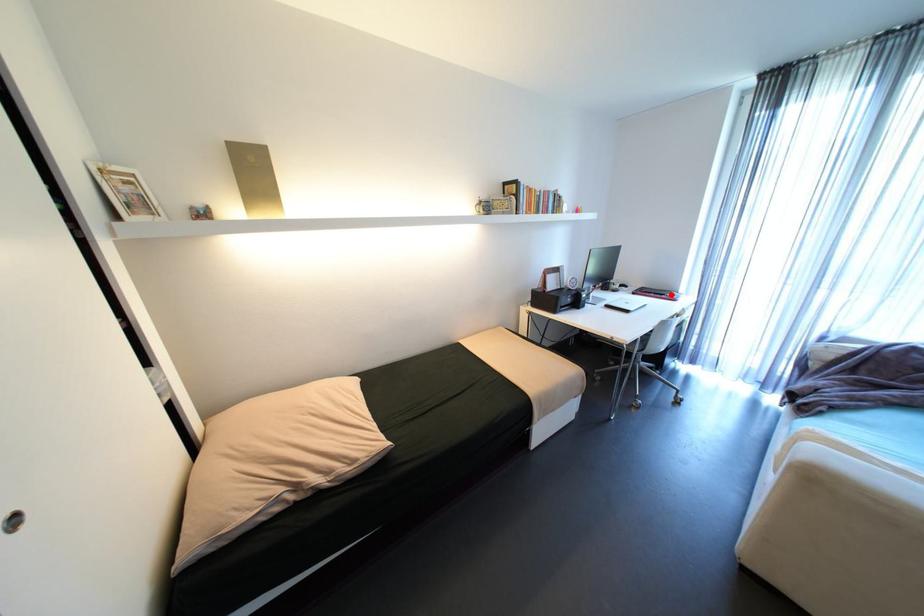
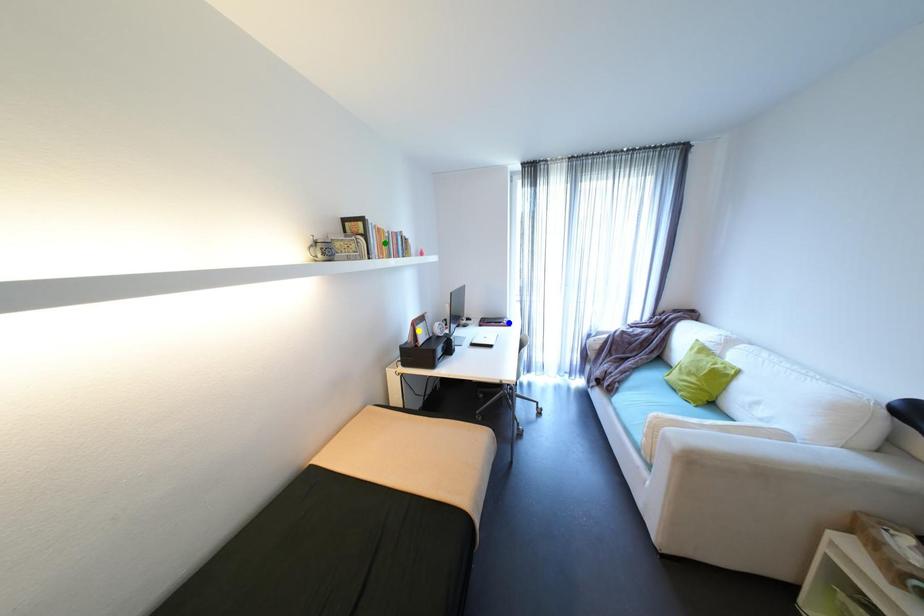
Question: I am providing you with two images of the same scene from different viewpoints. A red point is marked on the first image. You are given multiple points on the second image. Can you choose the point in image 2 that corresponds to the point in image 1?

Choices:
 (A) green point
 (B) blue point
 (C) yellow point

Answer: (B)